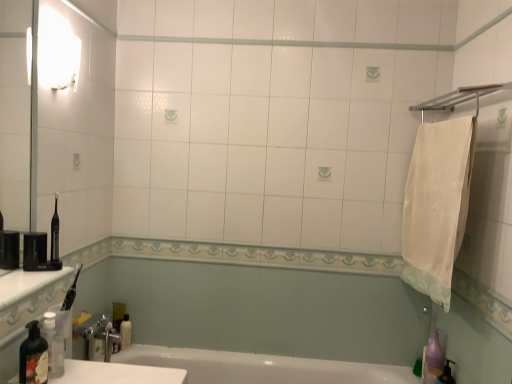
Question: Relative to white glossy sink at lower left, is translucent plastic soap dispenser at lower left, the first bottle in the front-to-back sequence, in front or behind?

Choices:
 (A) front
 (B) behind

Answer: (A)

Question: Is point (23, 342) positioned closer to the camera than point (71, 374)?

Choices:
 (A) farther
 (B) closer

Answer: (B)

Question: Which is nearer to the translucent plastic soap dispenser at lower left, the first bottle in the front-to-back sequence?

Choices:
 (A) transparent plastic bottle at lower left, the 2th bottle from the front
 (B) white glossy bottle at lower left
 (C) white cotton towel at right
 (D) white glossy sink at lower left

Answer: (A)

Question: Estimate the real-world distances between objects in this image. Which object is closer to the translucent plastic soap dispenser at lower left, arranged as the 2th bottle when viewed from the back?

Choices:
 (A) white glossy bottle at lower left
 (B) white glossy sink at lower left
 (C) transparent plastic bottle at lower left, the first bottle viewed from the back
 (D) white cotton towel at right

Answer: (C)